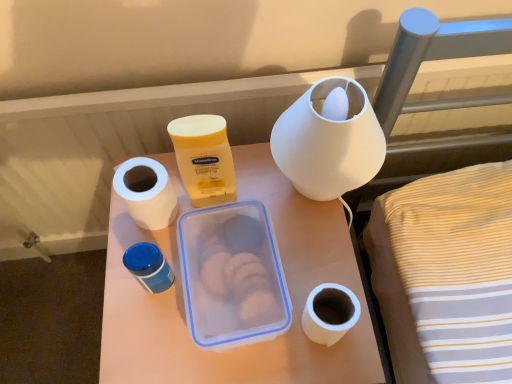
I want to click on free space on the front side of white matte paper towel at left, so click(x=150, y=306).